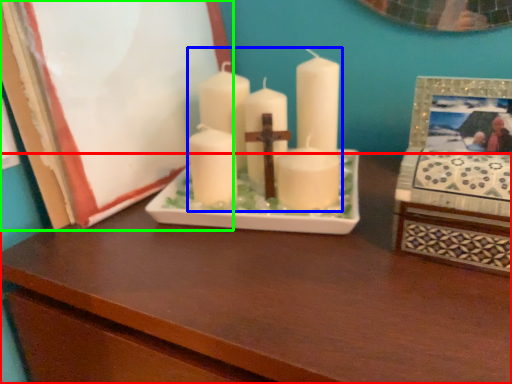
Question: Which object is positioned farthest from table (highlighted by a red box)? Select from candle (highlighted by a blue box) and picture frame (highlighted by a green box).

Choices:
 (A) candle
 (B) picture frame

Answer: (B)